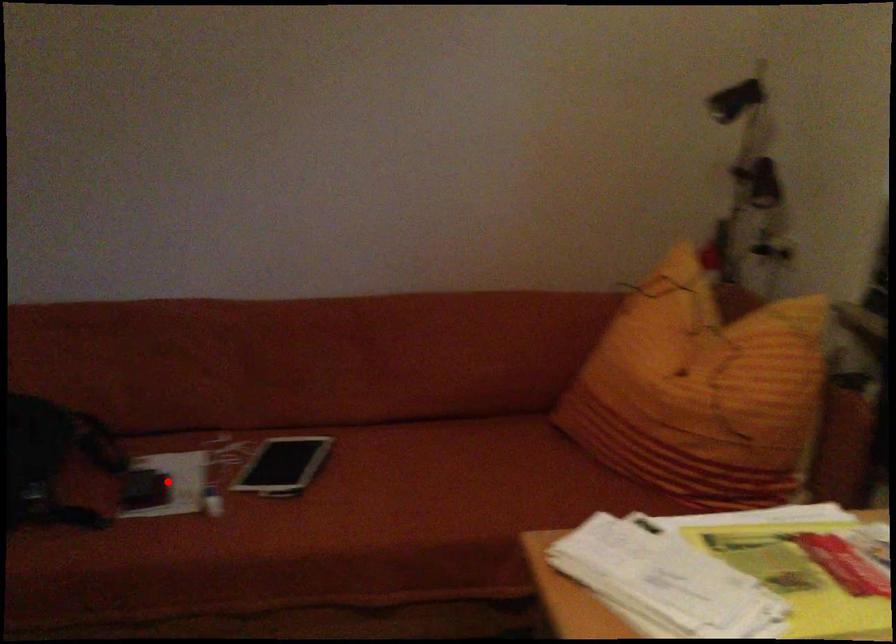
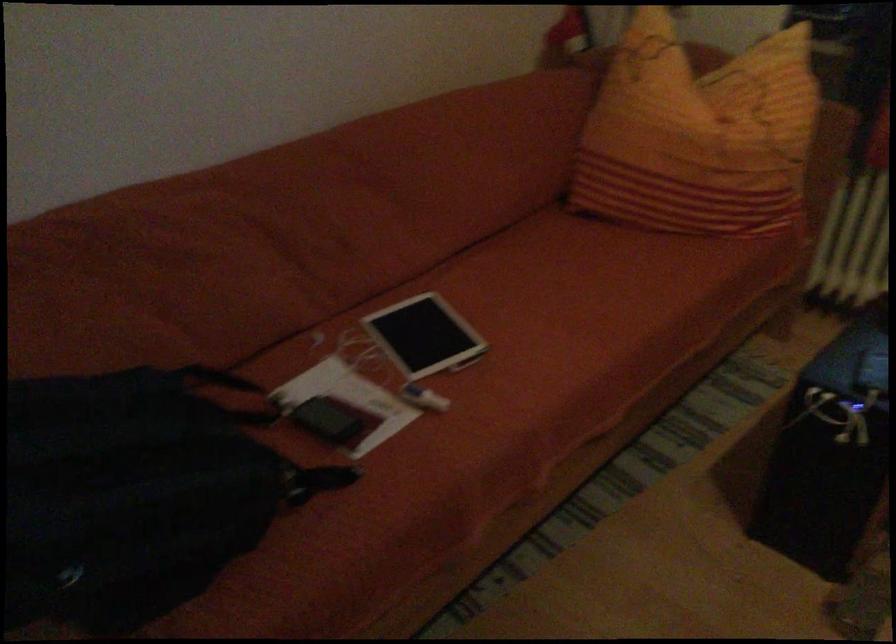
Question: I am providing you with two images of the same scene from different viewpoints. Given a red point in image1, look at the same physical point in image2. Is it:

Choices:
 (A) Closer to the viewpoint
 (B) Farther from the viewpoint

Answer: (A)